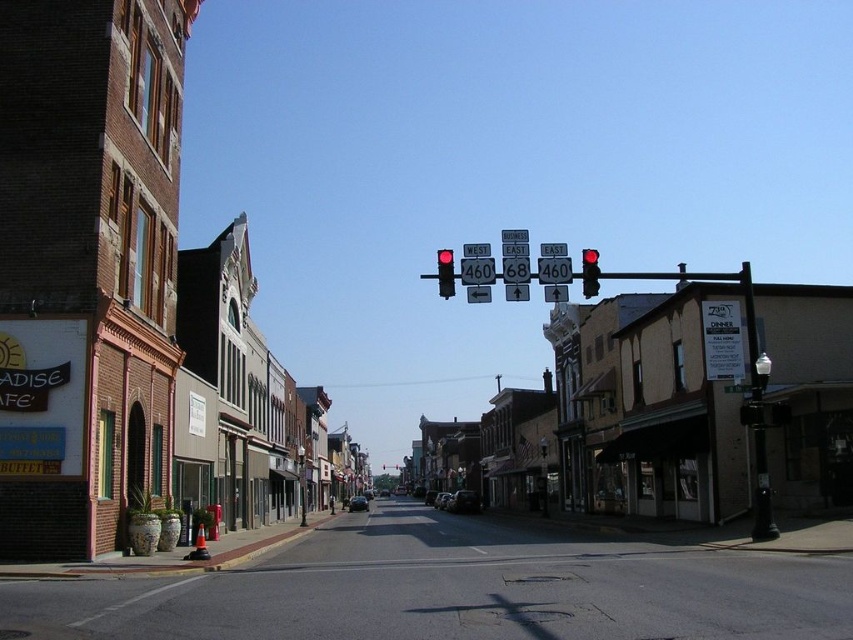
You are a delivery person trying to decide whether to park your van between the brick building at left and the red glass traffic light at center. The van is 2 meters tall. Can you park there without hitting the traffic light?

The brick building at left is shorter than the red glass traffic light at center, so the traffic light is taller. Since the van is 2 meters tall, you need to check if the traffic light is taller than 2 meters. However, the description only states the traffic light is taller than the building but doesn not provide exact measurements. Therefore, it is uncertain whether the van will hit the traffic light.

You are standing on the sidewalk and want to walk towards the two points marked in the image. Which point, point (593, 266) or point (450, 253), will you reach first?

Point (593, 266) is closer to the viewer than point (450, 253), so you will reach point (593, 266) first.

You are standing at the center of the road and want to go to the brick building at left. Which direction should you walk to reach it?

→ You should walk to the left since the brick building at left is located on the left side of the street.